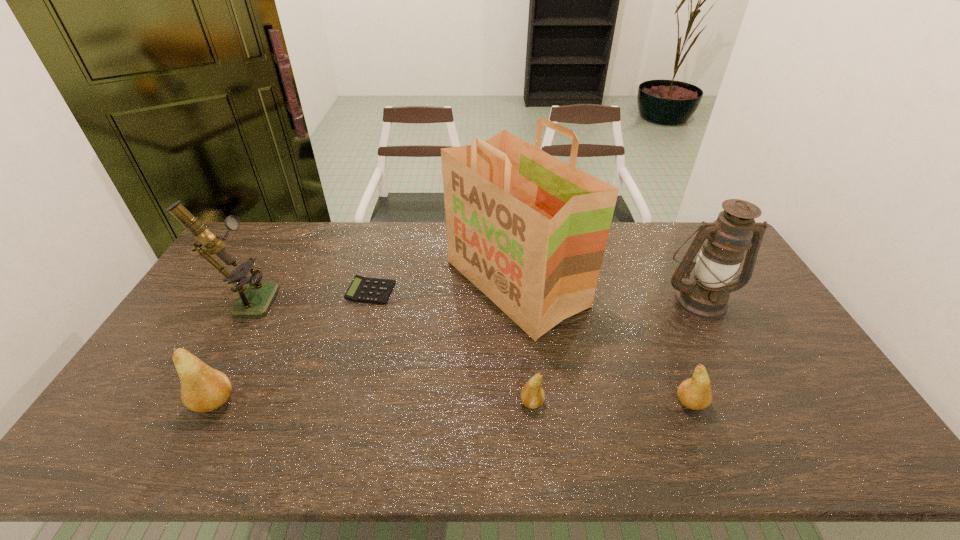
Please point a space for a new pear to maintain equal intervals. Please provide its 2D coordinates. Your answer should be formatted as a tuple, i.e. [(x, y)], where the tuple contains the x and y coordinates of a point satisfying the conditions above.

[(372, 402)]